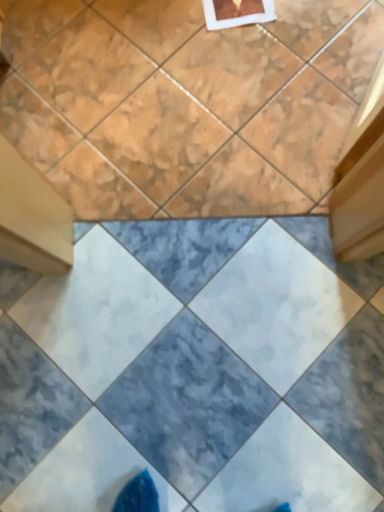
Question: Is marble tile at upper center, marked as the 1th ceramic tile in a top-to-bottom arrangement, in front of or behind marble-like ceramic tile at center, which is counted as the second ceramic tile, starting from the top, in the image?

Choices:
 (A) behind
 (B) front

Answer: (A)

Question: From a real-world perspective, is marble tile at upper center, marked as the 1th ceramic tile in a top-to-bottom arrangement, above or below marble-like ceramic tile at center, which ranks as the 1th ceramic tile in bottom-to-top order?

Choices:
 (A) below
 (B) above

Answer: (B)

Question: Based on their sizes in the image, would you say marble tile at upper center, marked as the 1th ceramic tile in a top-to-bottom arrangement, is bigger or smaller than marble-like ceramic tile at center, which is counted as the second ceramic tile, starting from the top?

Choices:
 (A) small
 (B) big

Answer: (B)

Question: From the image's perspective, is marble-like ceramic tile at center, which ranks as the 1th ceramic tile in bottom-to-top order, above or below marble tile at upper center, arranged as the 2th ceramic tile when ordered from the bottom?

Choices:
 (A) below
 (B) above

Answer: (A)

Question: From their relative heights in the image, would you say marble-like ceramic tile at center, which ranks as the 1th ceramic tile in bottom-to-top order, is taller or shorter than marble tile at upper center, arranged as the 2th ceramic tile when ordered from the bottom?

Choices:
 (A) tall
 (B) short

Answer: (A)

Question: Is point (21, 434) positioned closer to the camera than point (231, 120)?

Choices:
 (A) closer
 (B) farther

Answer: (A)

Question: Is marble-like ceramic tile at center, which ranks as the 1th ceramic tile in bottom-to-top order, wider or thinner than marble tile at upper center, marked as the 1th ceramic tile in a top-to-bottom arrangement?

Choices:
 (A) wide
 (B) thin

Answer: (B)